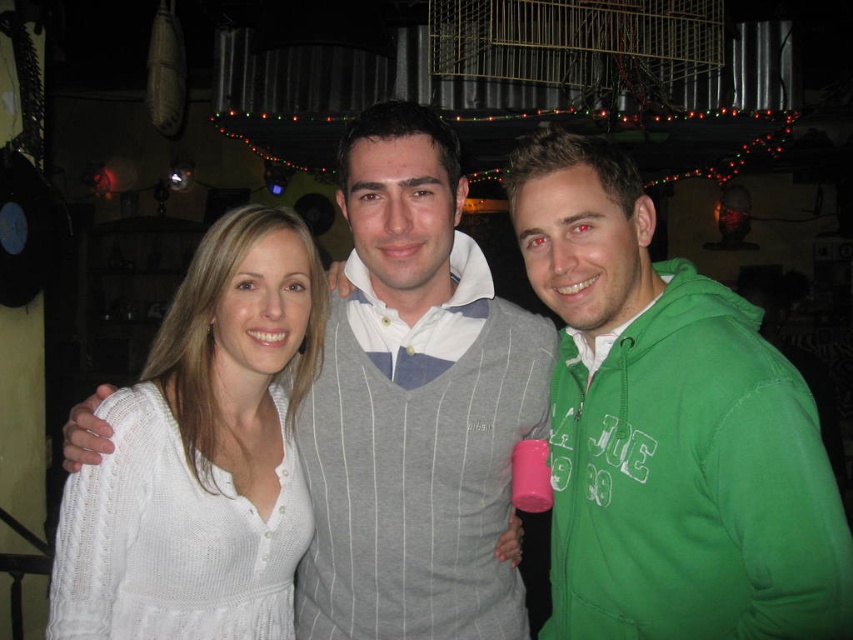
Question: Which of the following is the closest to the observer?

Choices:
 (A) (537, 244)
 (B) (54, 561)

Answer: (A)

Question: Is green fleece jacket at right to the left of white knitted sweater at center from the viewer's perspective?

Choices:
 (A) yes
 (B) no

Answer: (B)

Question: Can you confirm if green fleece jacket at right is smaller than white knitted sweater at center?

Choices:
 (A) yes
 (B) no

Answer: (B)

Question: Does green fleece jacket at right have a lesser width compared to white knitted sweater at center?

Choices:
 (A) yes
 (B) no

Answer: (B)